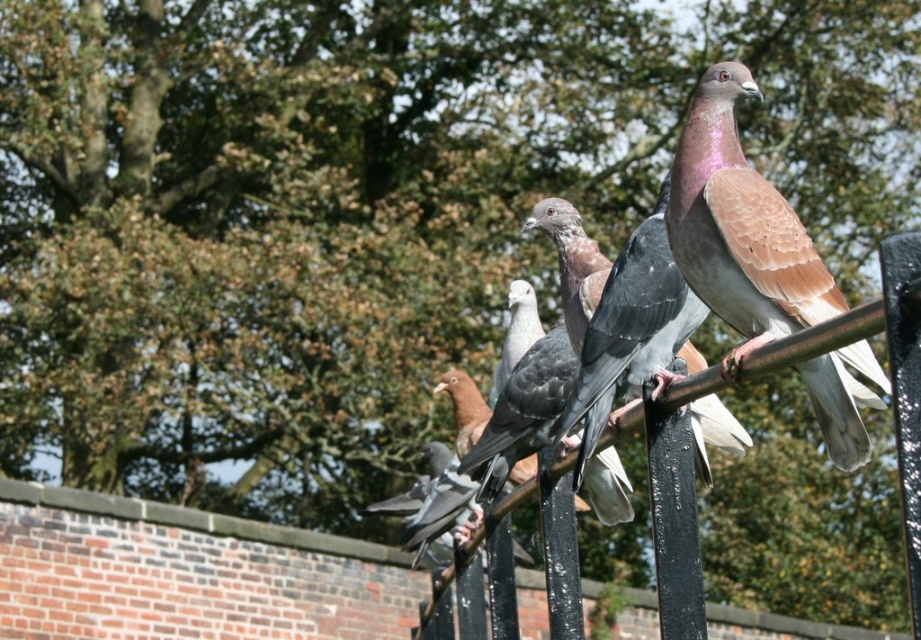
This screenshot has height=640, width=921. What do you see at coordinates (740, 228) in the screenshot? I see `purple-brown feathered pigeon at center` at bounding box center [740, 228].

Does purple-brown feathered pigeon at center have a greater width compared to brown speckled feathers at center?

No, purple-brown feathered pigeon at center is not wider than brown speckled feathers at center.

You are a GUI agent. You are given a task and a screenshot of the screen. Output one action in this format:
    pyautogui.click(x=<x>, y=<y>)
    Task: Click on the purple-brown feathered pigeon at center
    This screenshot has height=640, width=921.
    Given the screenshot: What is the action you would take?
    pyautogui.click(x=740, y=228)